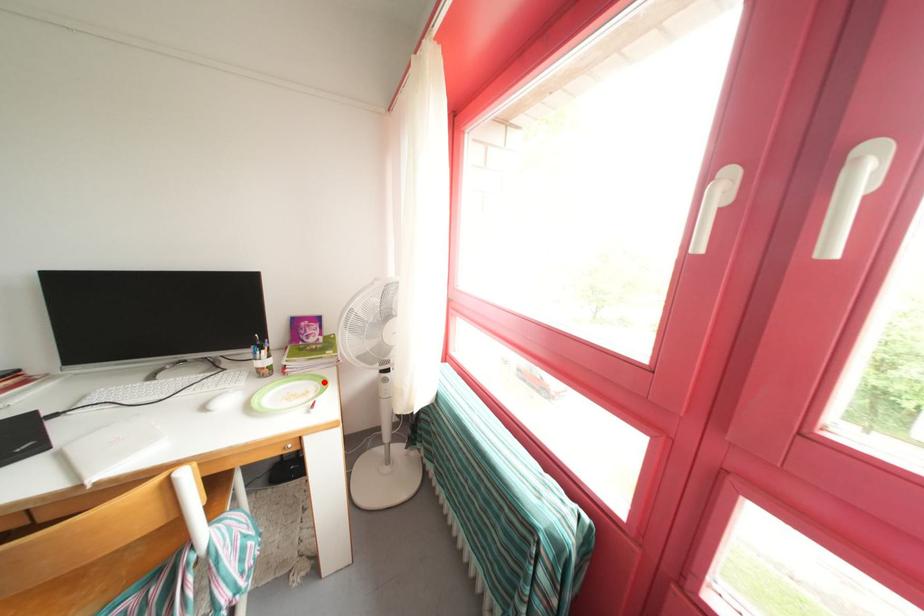
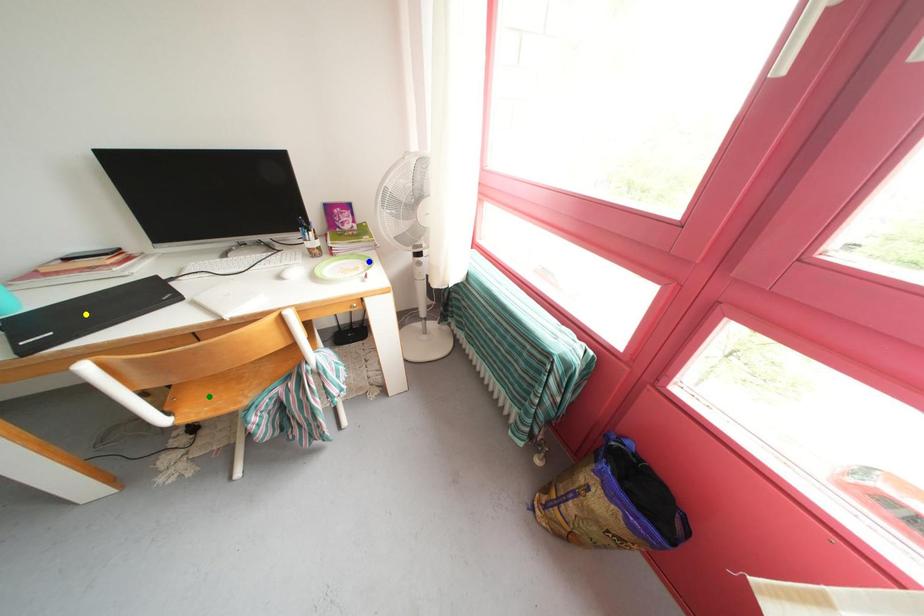
Question: I am providing you with two images of the same scene from different viewpoints. A red point is marked on the first image. You are given multiple points on the second image. Which spot in image 2 lines up with the point in image 1?

Choices:
 (A) yellow point
 (B) green point
 (C) blue point

Answer: (C)